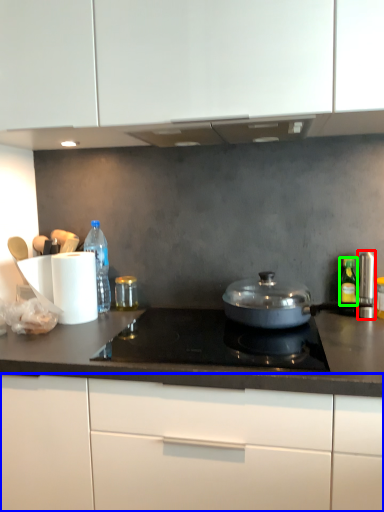
Question: Which object is the closest to the appliance (highlighted by a red box)? Choose among these: cabinetry (highlighted by a blue box) or bottle (highlighted by a green box).

Choices:
 (A) cabinetry
 (B) bottle

Answer: (B)